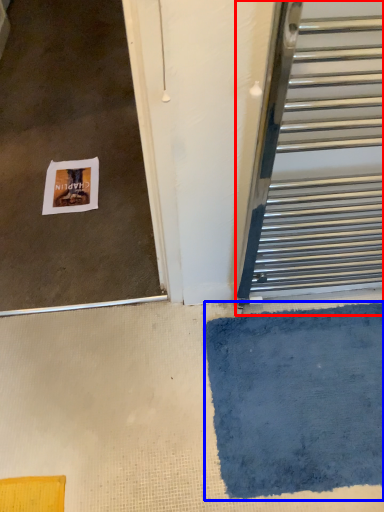
Question: Which point is closer to the camera, door (highlighted by a red box) or bath mat (highlighted by a blue box)?

Choices:
 (A) door
 (B) bath mat

Answer: (A)